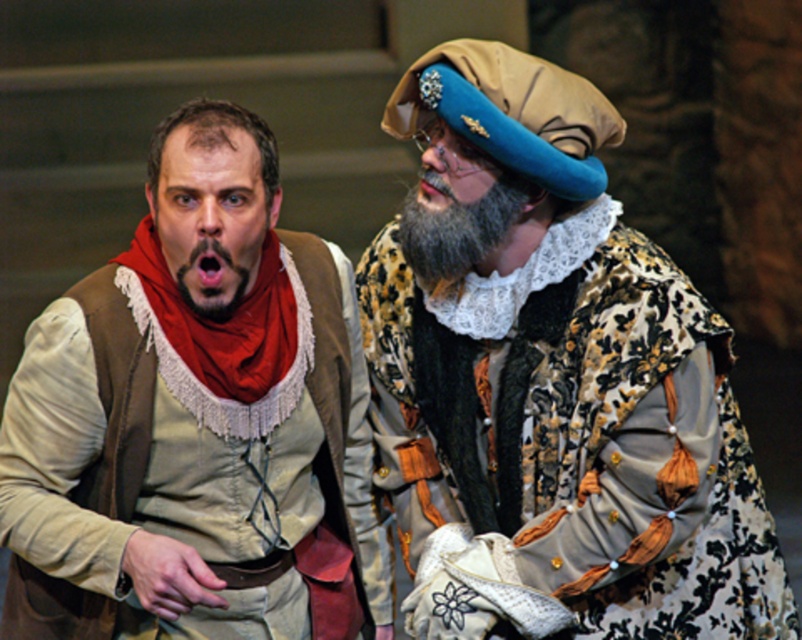
Question: Can you confirm if matte brown vest at left is smaller than dark brown fuzzy beard at left?

Choices:
 (A) no
 (B) yes

Answer: (A)

Question: Which point is farther from the camera taking this photo?

Choices:
 (A) (586, 369)
 (B) (503, 228)
 (C) (341, 282)

Answer: (C)

Question: Which point is closer to the camera?

Choices:
 (A) gray fuzzy beard at center
 (B) velvet floral robe at center
 (C) dark brown fuzzy beard at left
 (D) matte brown vest at left

Answer: (D)

Question: Does matte brown vest at left lie behind gray fuzzy beard at center?

Choices:
 (A) no
 (B) yes

Answer: (A)

Question: Is velvet floral robe at center to the left of dark brown fuzzy beard at left from the viewer's perspective?

Choices:
 (A) yes
 (B) no

Answer: (B)

Question: Estimate the real-world distances between objects in this image. Which object is farther from the dark brown fuzzy beard at left?

Choices:
 (A) gray fuzzy beard at center
 (B) velvet floral robe at center

Answer: (B)